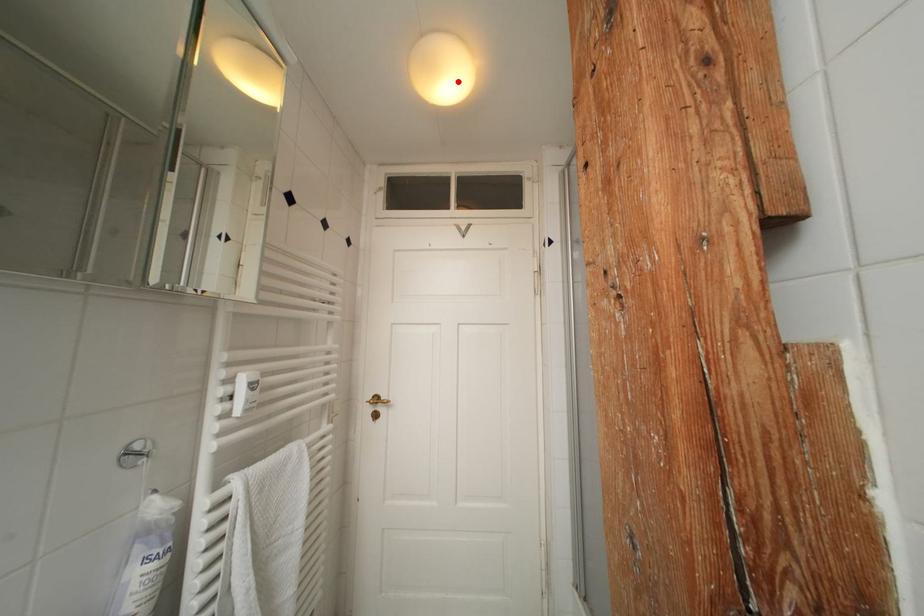
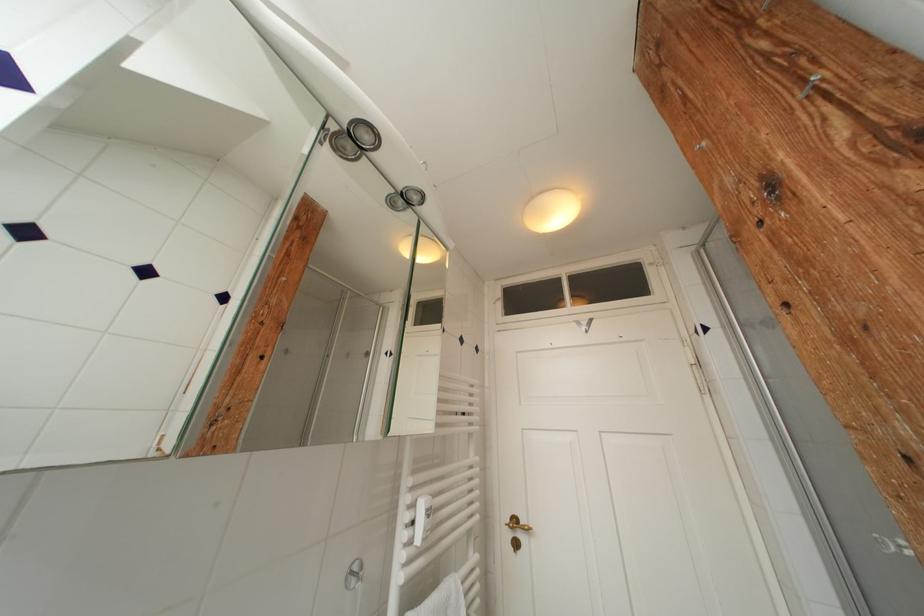
Locate, in the second image, the point that corresponds to the highlighted location in the first image.

(565, 217)